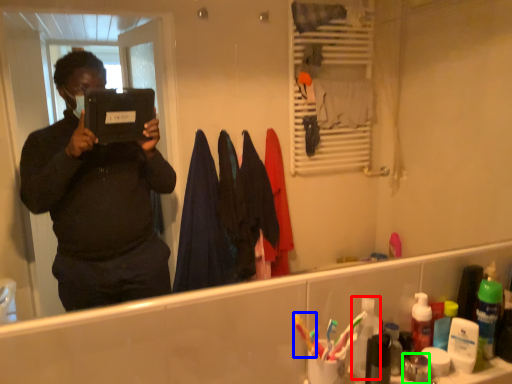
Question: Which object is positioned closest to toiletry (highlighted by a red box)? Select from toothbrush (highlighted by a blue box) and toiletry (highlighted by a green box).

Choices:
 (A) toothbrush
 (B) toiletry

Answer: (A)